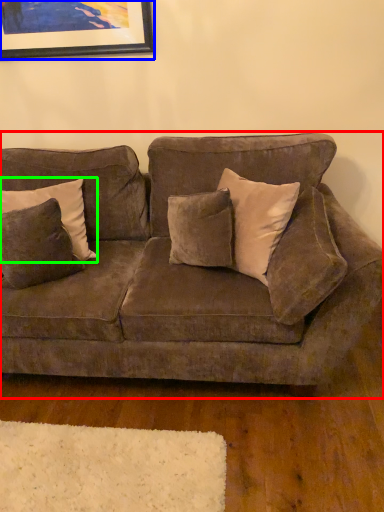
Question: Which object is the closest to the studio couch (highlighted by a red box)? Choose among these: picture frame (highlighted by a blue box) or pillow (highlighted by a green box).

Choices:
 (A) picture frame
 (B) pillow

Answer: (B)